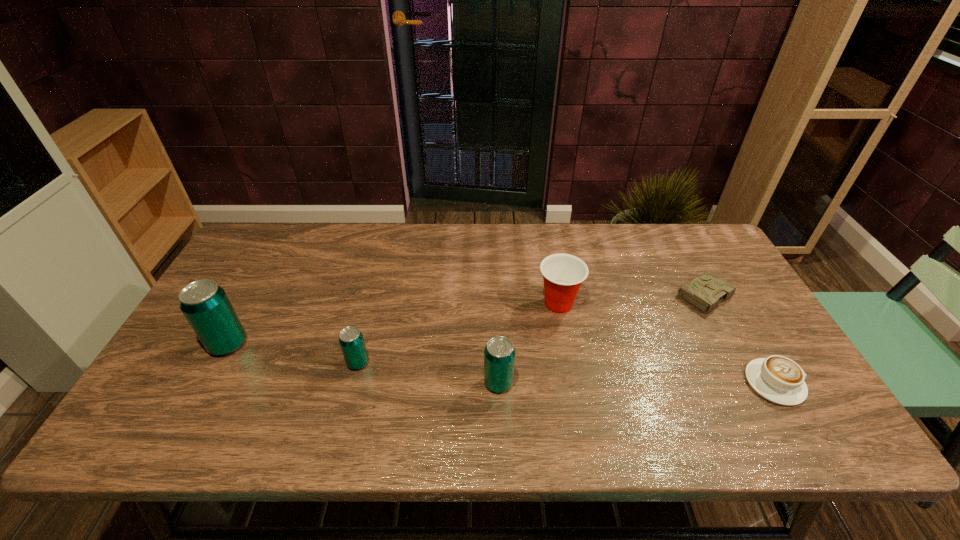
Where is `free spot at the far edge of the desktop`? The width and height of the screenshot is (960, 540). free spot at the far edge of the desktop is located at coordinates (300, 242).

You are a GUI agent. You are given a task and a screenshot of the screen. Output one action in this format:
    pyautogui.click(x=<x>, y=<y>)
    Task: Click on the vacant space at the near edge of the desktop
    
    Given the screenshot: What is the action you would take?
    pyautogui.click(x=659, y=381)

Find the location of a particular element. The width and height of the screenshot is (960, 540). vacant region at the right edge is located at coordinates (732, 316).

Where is `blank space at the far left corner of the desktop`? blank space at the far left corner of the desktop is located at coordinates (259, 235).

You are a GUI agent. You are given a task and a screenshot of the screen. Output one action in this format:
    pyautogui.click(x=<x>, y=<y>)
    Task: Click on the vacant space that is in between the fifth object from right to left and the tallest object
    The image size is (960, 540).
    Given the screenshot: What is the action you would take?
    pyautogui.click(x=293, y=353)

Identify the location of free space between the shortest beer can and the third object from right to left. This screenshot has width=960, height=540. (458, 333).

Where is `free space that is in between the cappuccino and the rightmost beer can`? The height and width of the screenshot is (540, 960). free space that is in between the cappuccino and the rightmost beer can is located at coordinates (636, 383).

This screenshot has height=540, width=960. Identify the location of unoccupied area between the diary and the rightmost beer can. (600, 339).

Find the location of a particular element. Image resolution: width=960 pixels, height=540 pixels. free spot between the cappuccino and the third shortest object is located at coordinates (566, 373).

This screenshot has width=960, height=540. I want to click on free point between the rightmost beer can and the second beer can from right to left, so click(x=428, y=373).